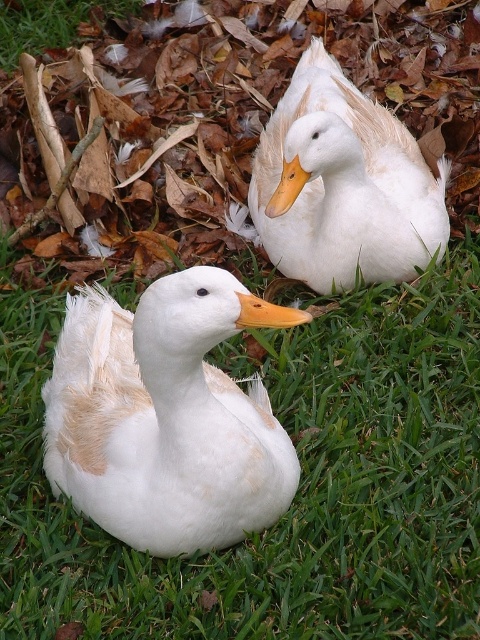
You are standing at the origin point of the image coordinate system. A white fluffy duck at center is located at point (163,419). What is the position of the white fluffy duck at center?

The white fluffy duck at center is located at point (163,419).

You are a birdwatcher observing two ducks in a grassy area. You notice their orange matte beak at center and orange matte beak at upper center. Which beak is positioned more to the left side of the image?

The orange matte beak at center is positioned more to the left side of the image compared to the orange matte beak at upper center.